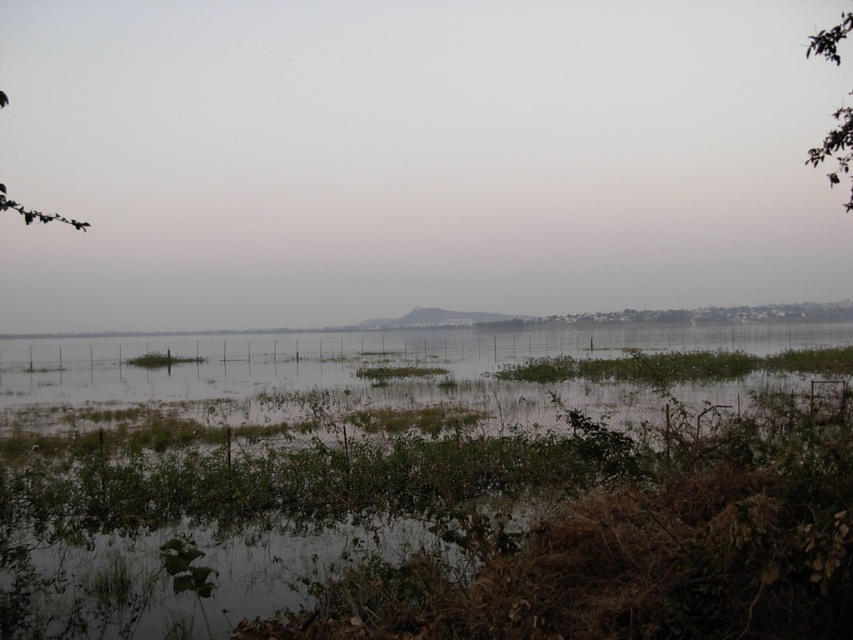
Does green leafy tree at upper right have a larger size compared to green leafy branch at upper left?

Yes, green leafy tree at upper right is bigger than green leafy branch at upper left.

Which is in front, point (846, 113) or point (20, 212)?

Point (20, 212)

This screenshot has width=853, height=640. Describe the element at coordinates (836, 150) in the screenshot. I see `green leafy tree at upper right` at that location.

This screenshot has width=853, height=640. What are the coordinates of `green leafy tree at upper right` in the screenshot? It's located at [x=836, y=150].